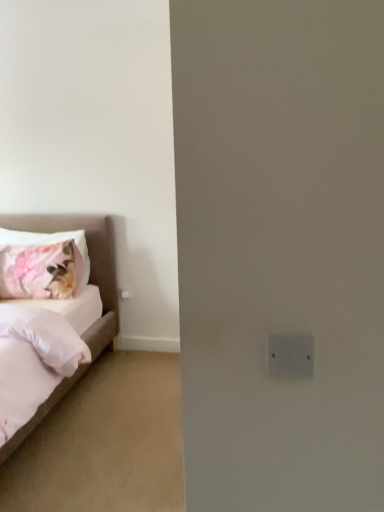
Question: Is floral fabric pillow at left wider than white fabric bed at left?

Choices:
 (A) yes
 (B) no

Answer: (B)

Question: Does floral fabric pillow at left have a larger size compared to white fabric bed at left?

Choices:
 (A) yes
 (B) no

Answer: (B)

Question: Could you tell me if floral fabric pillow at left is facing white fabric bed at left?

Choices:
 (A) no
 (B) yes

Answer: (B)

Question: From the image's perspective, would you say floral fabric pillow at left is shown under white fabric bed at left?

Choices:
 (A) yes
 (B) no

Answer: (B)

Question: From a real-world perspective, does floral fabric pillow at left sit lower than white fabric bed at left?

Choices:
 (A) yes
 (B) no

Answer: (B)

Question: Is floral fabric pillow at left positioned beyond the bounds of white fabric bed at left?

Choices:
 (A) no
 (B) yes

Answer: (A)

Question: Is white fabric bed at left outside floral fabric pillow at left?

Choices:
 (A) yes
 (B) no

Answer: (A)

Question: Is white fabric bed at left behind floral fabric pillow at left?

Choices:
 (A) yes
 (B) no

Answer: (B)

Question: Can you confirm if white fabric bed at left is bigger than floral fabric pillow at left?

Choices:
 (A) no
 (B) yes

Answer: (B)

Question: Could you tell me if white fabric bed at left is turned towards floral fabric pillow at left?

Choices:
 (A) no
 (B) yes

Answer: (A)

Question: Does white fabric bed at left touch floral fabric pillow at left?

Choices:
 (A) no
 (B) yes

Answer: (A)

Question: Can you confirm if white fabric bed at left is positioned to the right of floral fabric pillow at left?

Choices:
 (A) yes
 (B) no

Answer: (B)

Question: Is white fabric bed at left to the left or to the right of floral fabric pillow at left in the image?

Choices:
 (A) left
 (B) right

Answer: (A)